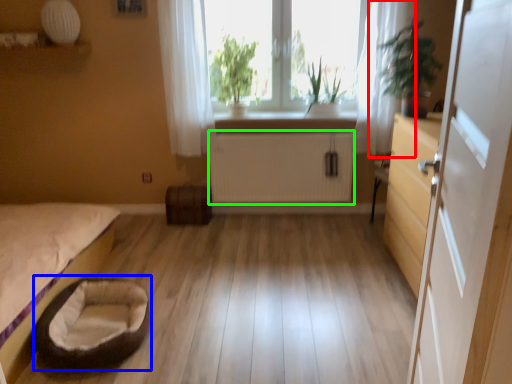
Question: Estimate the real-world distances between objects in this image. Which object is farther from curtain (highlighted by a red box), infant bed (highlighted by a blue box) or radiator (highlighted by a green box)?

Choices:
 (A) infant bed
 (B) radiator

Answer: (A)